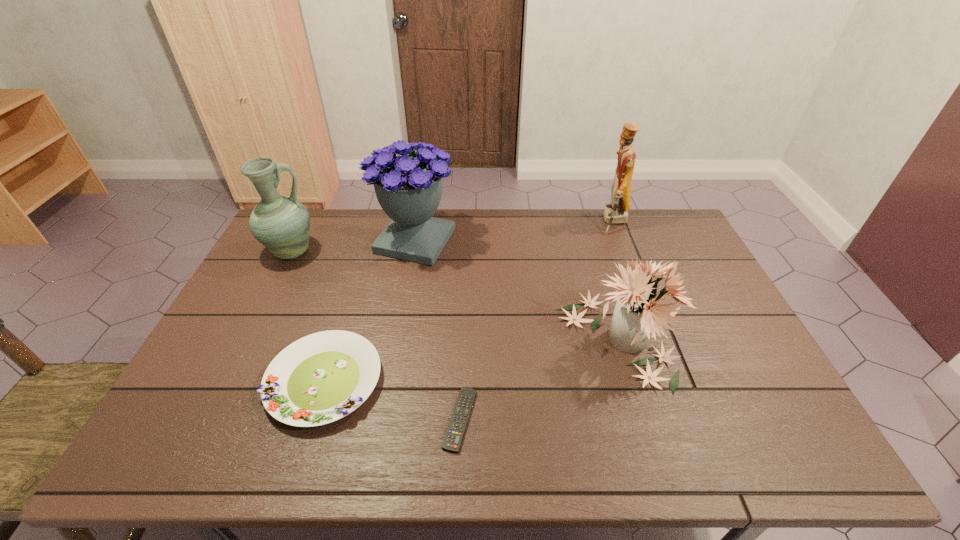
The height and width of the screenshot is (540, 960). I want to click on nutcracker, so click(616, 212).

I want to click on the taller bouquet, so click(408, 188).

Where is `the left bouquet`? This screenshot has width=960, height=540. the left bouquet is located at coordinates (408, 188).

The image size is (960, 540). What are the coordinates of `pitcher` in the screenshot? It's located at (281, 223).

Image resolution: width=960 pixels, height=540 pixels. I want to click on the right bouquet, so click(x=639, y=312).

Image resolution: width=960 pixels, height=540 pixels. I want to click on the nearer bouquet, so click(x=639, y=312).

Locate an element on the screen. The width and height of the screenshot is (960, 540). the second shortest object is located at coordinates point(320,378).

Where is `the shortest object`? This screenshot has height=540, width=960. the shortest object is located at coordinates point(452,442).

This screenshot has width=960, height=540. Find the location of `vacant space situated on the front-facing side of the nutcracker`. vacant space situated on the front-facing side of the nutcracker is located at coordinates (536, 222).

Where is `vacant region located on the front-facing side of the nutcracker`? vacant region located on the front-facing side of the nutcracker is located at coordinates (517, 222).